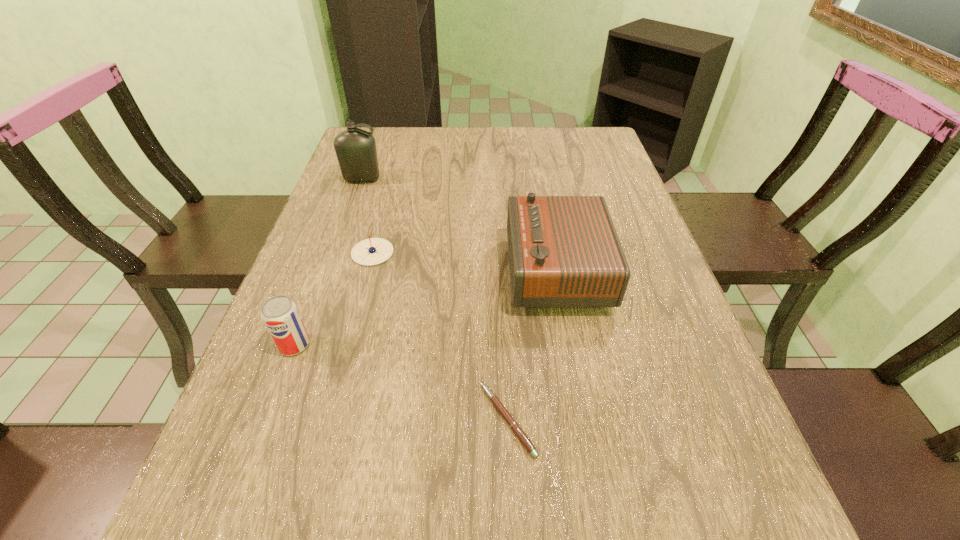
Locate an element on the screen. This screenshot has width=960, height=540. object present at the right edge is located at coordinates (564, 252).

At what (x,y) coordinates should I click in order to perform the action: click on free space at the far edge of the desktop. Please return your answer as a coordinate pair (x, y). The image size is (960, 540). Looking at the image, I should click on (515, 140).

At what (x,y) coordinates should I click in order to perform the action: click on free space at the left edge of the desktop. Please return your answer as a coordinate pair (x, y). Looking at the image, I should click on pyautogui.click(x=302, y=269).

Find the location of a particular element. free space at the right edge is located at coordinates (670, 321).

Identify the location of vacant space at the far left corner of the desktop. (379, 144).

Locate an element on the screen. vacant region between the radio receiver and the fourth tallest object is located at coordinates (465, 261).

Locate an element on the screen. The image size is (960, 540). vacant space in between the third shortest object and the farthest object is located at coordinates click(x=328, y=262).

Image resolution: width=960 pixels, height=540 pixels. I want to click on empty location between the soda and the compass, so click(x=333, y=299).

This screenshot has width=960, height=540. What are the coordinates of `unoccupied position between the second tallest object and the shortest object` in the screenshot? It's located at (532, 345).

What are the coordinates of `free space between the nearest object and the second shortest object` in the screenshot? It's located at (440, 336).